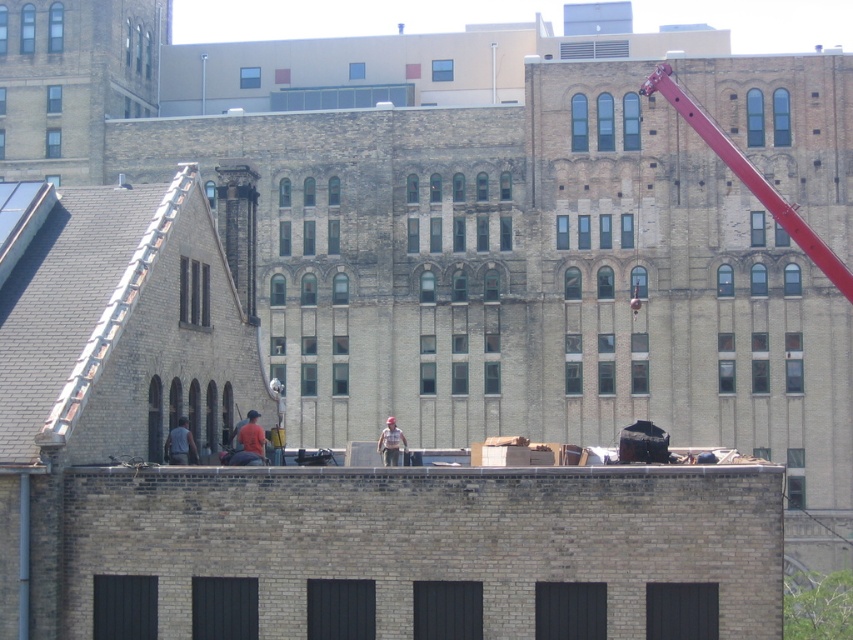
Question: Which of the following is the farthest from the observer?

Choices:
 (A) (383, 436)
 (B) (680, 92)

Answer: (B)

Question: Which is farther from the dark gray fabric jacket at center?

Choices:
 (A) red metallic crane at upper right
 (B) camouflage fabric worker at center

Answer: (A)

Question: Can you confirm if red metallic crane at upper right is smaller than camouflage fabric worker at center?

Choices:
 (A) no
 (B) yes

Answer: (A)

Question: Is red metallic crane at upper right wider than dark gray fabric jacket at center?

Choices:
 (A) no
 (B) yes

Answer: (B)

Question: Which object is positioned farthest from the camouflage fabric worker at center?

Choices:
 (A) dark gray fabric jacket at center
 (B) red metallic crane at upper right

Answer: (B)

Question: Observing the image, what is the correct spatial positioning of dark gray fabric jacket at center in reference to camouflage fabric worker at center?

Choices:
 (A) below
 (B) above

Answer: (B)